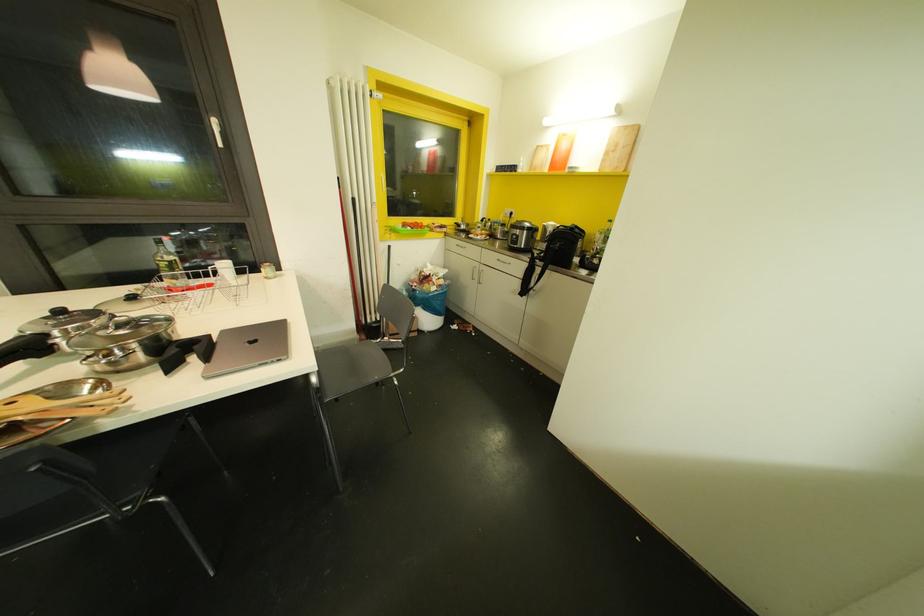
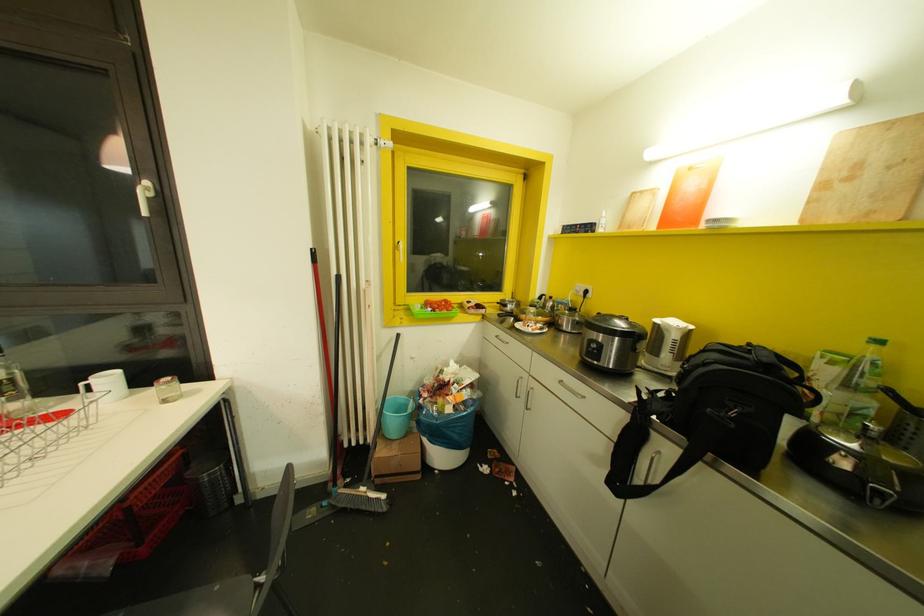
Question: Based on the continuous images, in which direction is the camera rotating? Reply with the corresponding letter.

Choices:
 (A) Left
 (B) Right
 (C) Up
 (D) Down

Answer: (A)